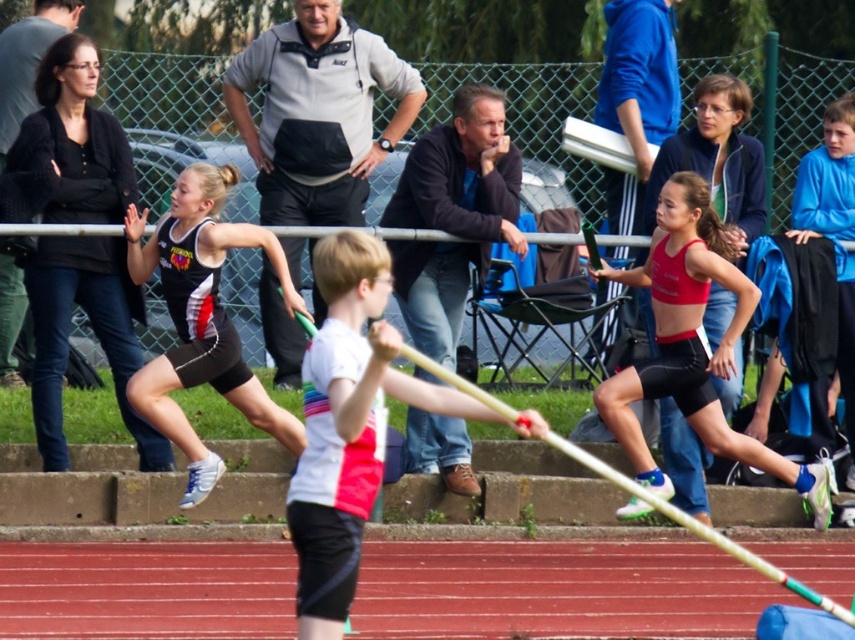
In order to click on white/red striped shirt at center in this screenshot , I will do `click(351, 424)`.

This screenshot has height=640, width=855. What do you see at coordinates (693, 346) in the screenshot? I see `matte red crop top at center` at bounding box center [693, 346].

Between point (688, 362) and point (203, 209), which one is positioned behind?

Point (688, 362)

Image resolution: width=855 pixels, height=640 pixels. I want to click on matte red crop top at center, so click(x=693, y=346).

Can you confirm if white/red striped shirt at center is positioned below black matte shorts at left?

Yes.

Is point (382, 419) in front of point (203, 468)?

Yes.

Is point (349, 483) positioned before point (134, 214)?

Yes, point (349, 483) is in front of point (134, 214).

This screenshot has width=855, height=640. In order to click on white/red striped shirt at center in this screenshot , I will do `click(351, 424)`.